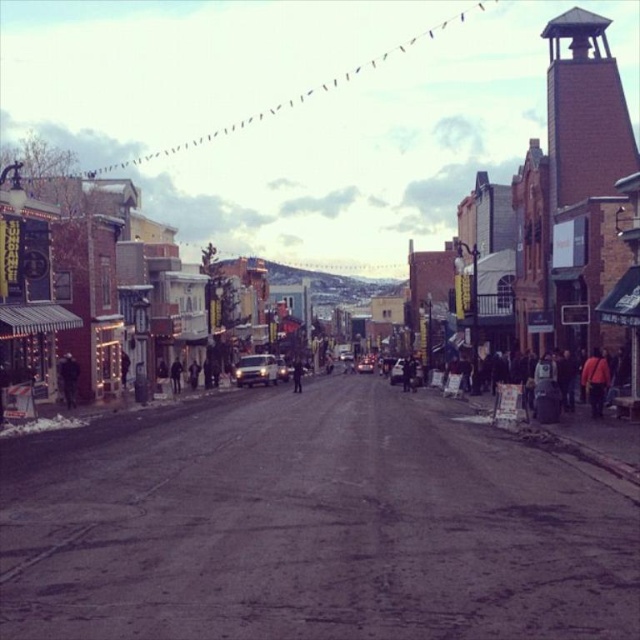
You are a delivery person needing to cross the street from the dark gray fabric crowd at center right to the metallic silver car at center. Given that the distance between them is 20.15 meters, and you can walk at 1.5 meters per second, how many seconds will it take you to reach the car?

The distance between the dark gray fabric crowd at center right and the metallic silver car at center is 20.15 meters. Walking at a speed of 1.5 meters per second, it would take approximately 13.43 seconds to reach the car.

You are a delivery driver who needs to park your shiny silver sedan at center in a spot that is 52.19 meters away. Is there enough space between the buildings on either side of the street for your vehicle to maneuver safely?

The space between the buildings on either side of the street is 52.19 meters, which is more than enough for the shiny silver sedan at center to maneuver safely.